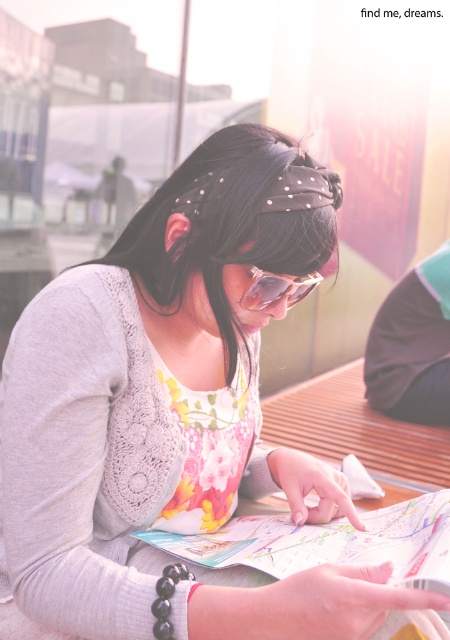
Question: Which point is closer to the camera taking this photo?

Choices:
 (A) (255, 284)
 (B) (436, 352)

Answer: (A)

Question: Is dark fabric at lower right above sunglasses at center?

Choices:
 (A) yes
 (B) no

Answer: (B)

Question: Does dark fabric at lower right appear under sunglasses at center?

Choices:
 (A) no
 (B) yes

Answer: (B)

Question: Considering the relative positions of dark fabric at lower right and sunglasses at center in the image provided, where is dark fabric at lower right located with respect to sunglasses at center?

Choices:
 (A) above
 (B) below

Answer: (B)

Question: Which point appears farthest from the camera in this image?

Choices:
 (A) (298, 282)
 (B) (395, 348)

Answer: (B)

Question: Which object is closer to the camera taking this photo?

Choices:
 (A) dark fabric at lower right
 (B) sunglasses at center

Answer: (B)